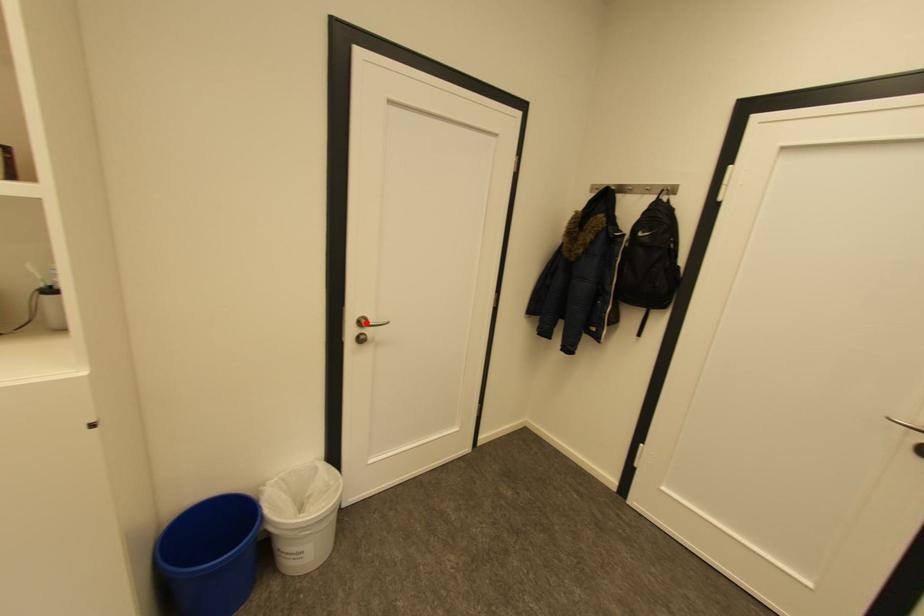
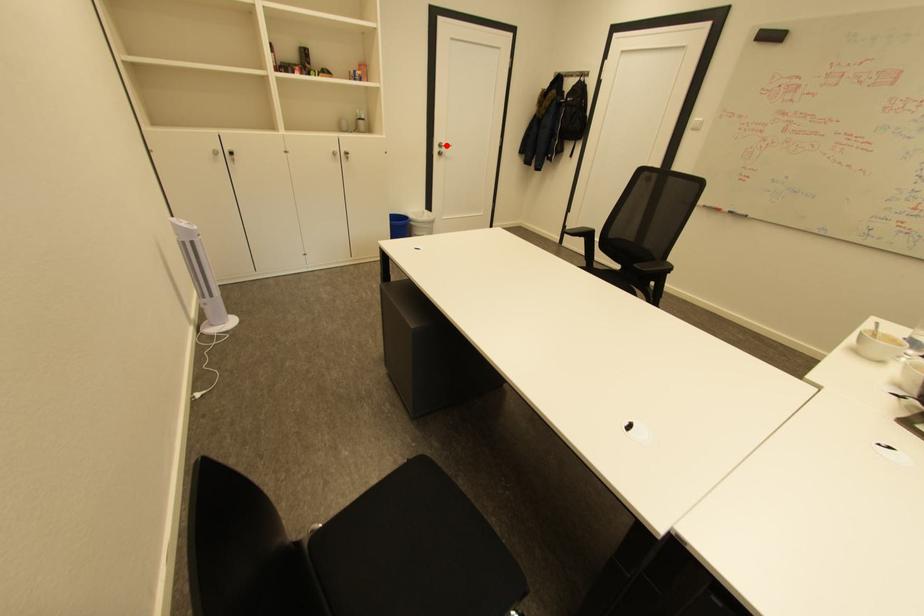
I am providing you with two images of the same scene from different viewpoints. A red point is marked on the first image and another point is marked on the second image. Does the point marked in image1 correspond to the same location as the one in image2?

Yes